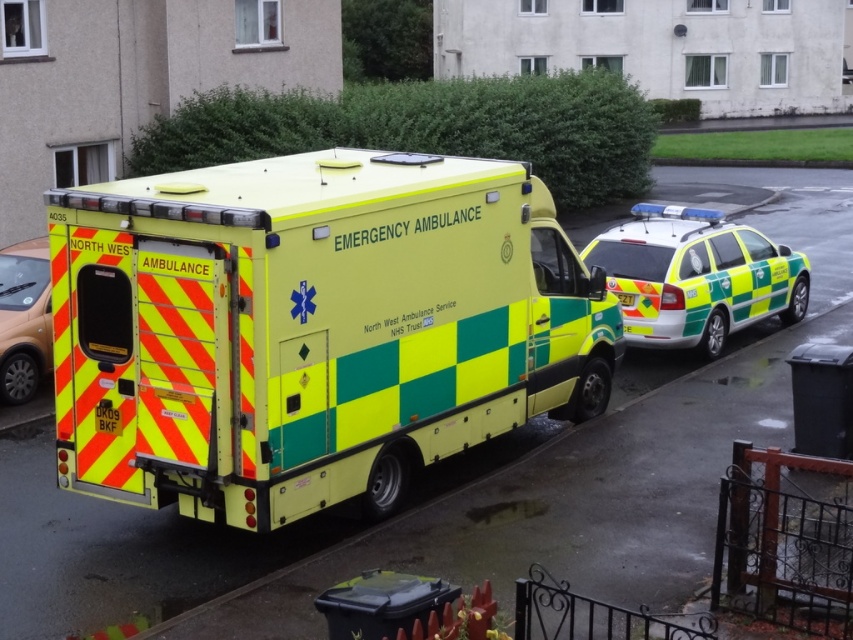
You are a traffic officer trying to determine the positions of vehicles for a report. The scene includes a North West Emergency Ambulance and a green and yellow painted car at right. Which vehicle is positioned closer to the right side of the image?

The green and yellow painted car at right is located at point (695, 276), which places it closer to the right side of the image compared to the ambulance.